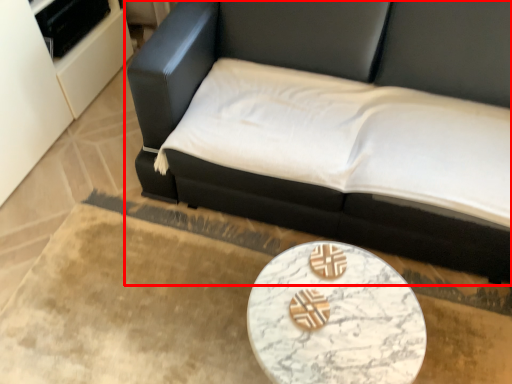
Question: Where is studio couch (annotated by the red box) located in relation to table in the image?

Choices:
 (A) right
 (B) left

Answer: (A)